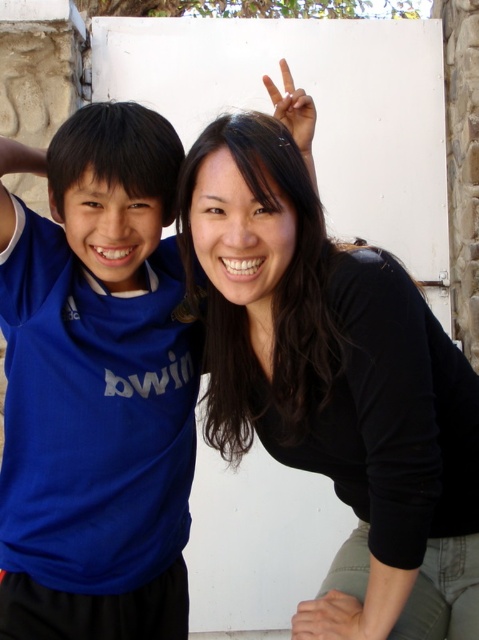
Is black matte shirt at center below white matte hand at upper center?

Indeed, black matte shirt at center is positioned under white matte hand at upper center.

Is the position of black matte shirt at center more distant than that of white matte hand at upper center?

No.

Is point (315, 387) closer to camera compared to point (274, 108)?

Yes, it is in front of point (274, 108).

I want to click on black matte shirt at center, so click(330, 362).

Between point (15, 161) and point (363, 412), which one is positioned in front?

Positioned in front is point (363, 412).

Is blue fabric shirt at left positioned before black matte shirt at center?

No.

Is point (83, 124) positioned behind point (474, 620)?

Yes.

This screenshot has width=479, height=640. Identify the location of blue fabric shirt at left. (98, 388).

Does blue fabric shirt at left come behind smooth skin hand at lower center?

Yes, blue fabric shirt at left is further from the viewer.

Who is positioned more to the right, blue fabric shirt at left or smooth skin hand at lower center?

From the viewer's perspective, smooth skin hand at lower center appears more on the right side.

The width and height of the screenshot is (479, 640). I want to click on blue fabric shirt at left, so click(x=98, y=388).